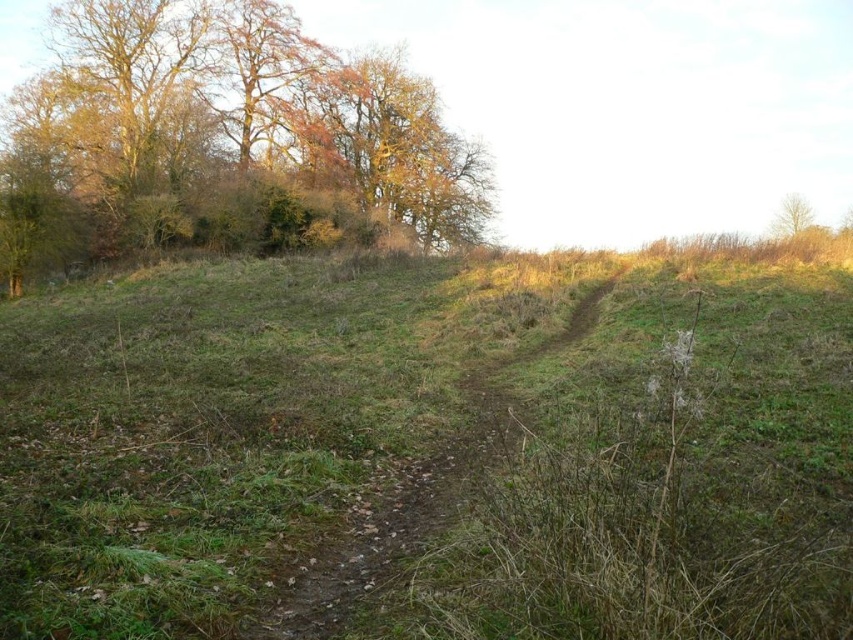
Question: Which object appears farthest from the camera in this image?

Choices:
 (A) dirt path at center
 (B) brown leafy trees at upper left
 (C) green grassy at center

Answer: (B)

Question: Which point is farther from the camera taking this photo?

Choices:
 (A) (795, 220)
 (B) (346, 230)
 (C) (315, 627)
 (D) (814, 554)

Answer: (A)

Question: Which point is farther from the camera taking this photo?

Choices:
 (A) (302, 221)
 (B) (347, 592)

Answer: (A)

Question: Considering the relative positions of dirt path at center and green leafy tree at upper right in the image provided, where is dirt path at center located with respect to green leafy tree at upper right?

Choices:
 (A) left
 (B) right

Answer: (A)

Question: From the image, what is the correct spatial relationship of brown leafy trees at upper left in relation to green leafy tree at upper right?

Choices:
 (A) right
 (B) left

Answer: (B)

Question: Is brown leafy trees at upper left closer to camera compared to dirt path at center?

Choices:
 (A) no
 (B) yes

Answer: (A)